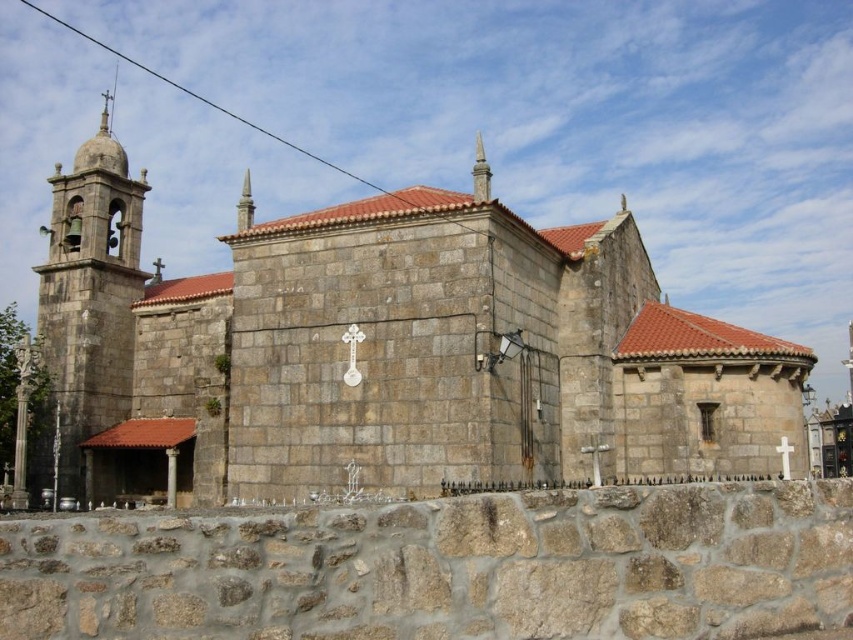
Who is more distant from viewer, (146, 401) or (120, 320)?

The point (120, 320) is behind.

Measure the distance between stone church at center and camera.

stone church at center is 142.80 feet away from camera.

What do you see at coordinates (386, 352) in the screenshot? This screenshot has width=853, height=640. I see `stone church at center` at bounding box center [386, 352].

Where is `stone church at center`? The height and width of the screenshot is (640, 853). stone church at center is located at coordinates (386, 352).